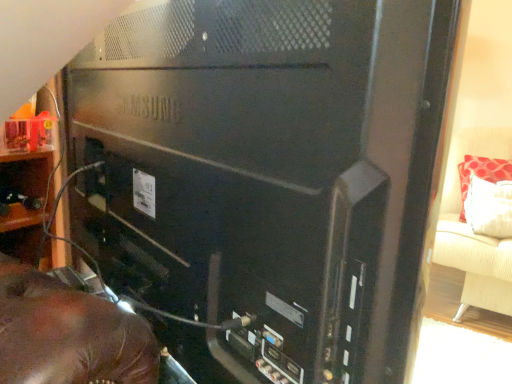
Question: Considering the relative sizes of black matte computer tower at center and red fabric pillow at right in the image provided, is black matte computer tower at center thinner than red fabric pillow at right?

Choices:
 (A) yes
 (B) no

Answer: (A)

Question: Does black matte computer tower at center have a larger size compared to red fabric pillow at right?

Choices:
 (A) no
 (B) yes

Answer: (B)

Question: Does black matte computer tower at center turn towards red fabric pillow at right?

Choices:
 (A) yes
 (B) no

Answer: (A)

Question: Is black matte computer tower at center oriented away from red fabric pillow at right?

Choices:
 (A) no
 (B) yes

Answer: (A)

Question: From the image's perspective, is black matte computer tower at center under red fabric pillow at right?

Choices:
 (A) yes
 (B) no

Answer: (A)

Question: From a real-world perspective, is black matte computer tower at center below red fabric pillow at right?

Choices:
 (A) no
 (B) yes

Answer: (A)

Question: Would you say red fabric pillow at right contains wooden shelf at left?

Choices:
 (A) yes
 (B) no

Answer: (B)

Question: Is red fabric pillow at right facing away from wooden shelf at left?

Choices:
 (A) no
 (B) yes

Answer: (A)

Question: Does red fabric pillow at right lie behind wooden shelf at left?

Choices:
 (A) no
 (B) yes

Answer: (B)

Question: Considering the relative sizes of red fabric pillow at right and wooden shelf at left in the image provided, is red fabric pillow at right taller than wooden shelf at left?

Choices:
 (A) yes
 (B) no

Answer: (A)

Question: Does red fabric pillow at right appear on the left side of wooden shelf at left?

Choices:
 (A) yes
 (B) no

Answer: (B)

Question: From a real-world perspective, is red fabric pillow at right below wooden shelf at left?

Choices:
 (A) yes
 (B) no

Answer: (A)

Question: Is beige fabric couch at right smaller than black matte computer tower at center?

Choices:
 (A) yes
 (B) no

Answer: (B)